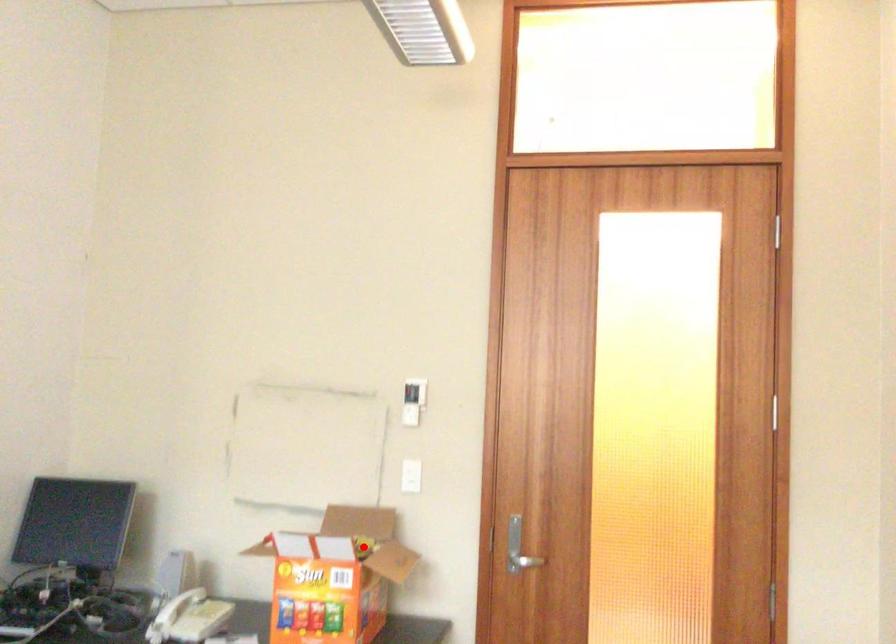
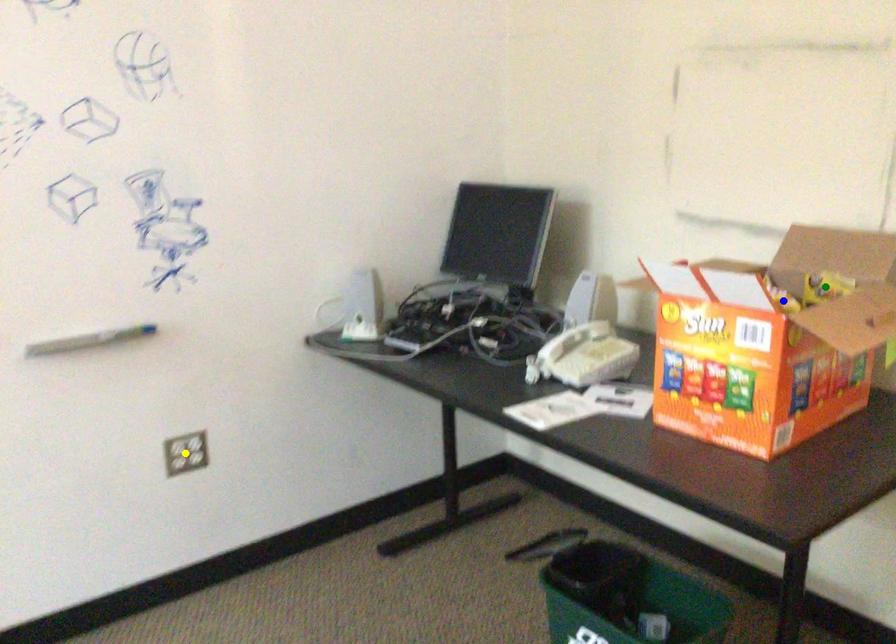
Question: I am providing you with two images of the same scene from different viewpoints. A red point is marked on the first image. You are given multiple points on the second image. Which mark in image 2 goes with the point in image 1?

Choices:
 (A) blue point
 (B) yellow point
 (C) green point

Answer: (C)